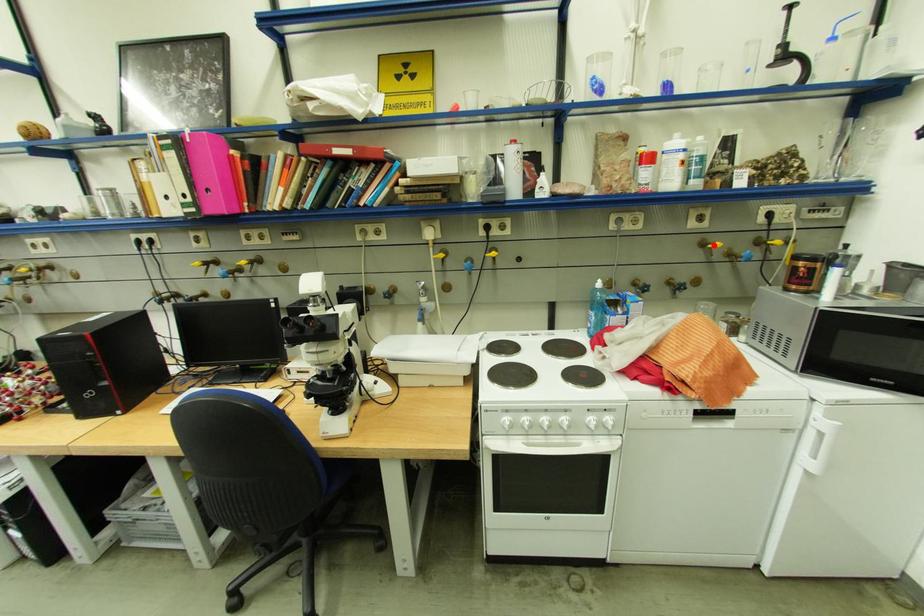
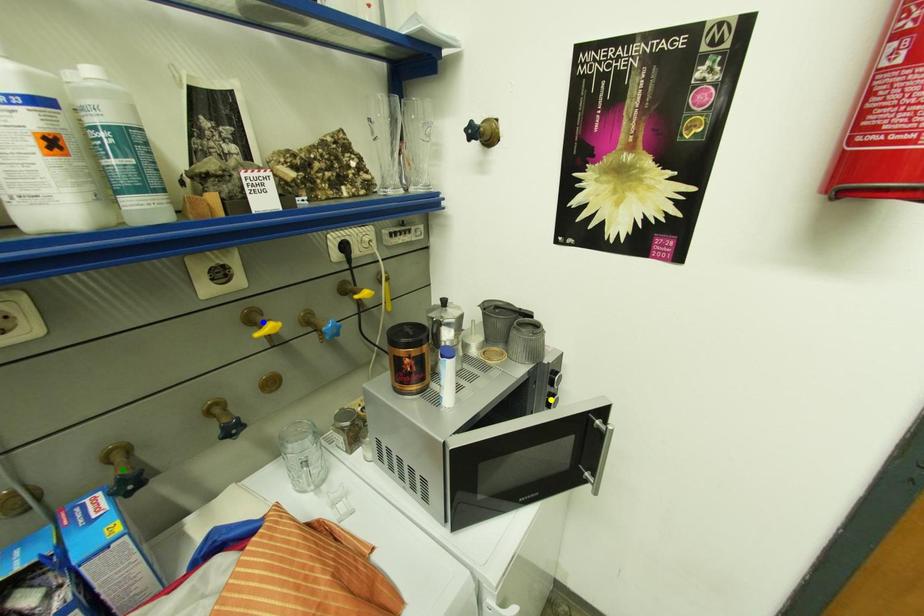
Question: I am providing you with two images of the same scene from different viewpoints. A red point is marked on the first image. You are given multiple points on the second image. Can you choose the point in image 2 that corresponds to the point in image 1?

Choices:
 (A) yellow point
 (B) blue point
 (C) green point

Answer: (B)